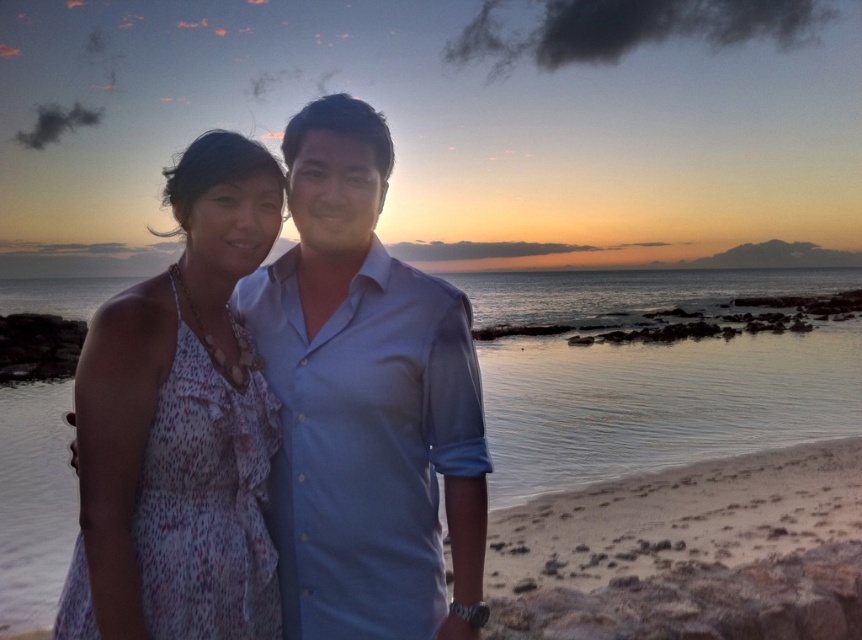
Who is positioned more to the right, light blue shirt at center or clear water at center?

clear water at center is more to the right.

Does light blue shirt at center appear under clear water at center?

Yes, light blue shirt at center is below clear water at center.

Identify the location of light blue shirt at center. pyautogui.click(x=365, y=403).

Is light blue shirt at center shorter than white dotted dress at left?

No.

Does light blue shirt at center lie in front of white dotted dress at left?

No, light blue shirt at center is further to the viewer.

Find the location of a particular element. This screenshot has width=862, height=640. light blue shirt at center is located at coordinates (365, 403).

Can you confirm if clear water at center is smaller than white dotted dress at left?

Actually, clear water at center might be larger than white dotted dress at left.

Does clear water at center appear under white dotted dress at left?

No.

Is point (536, 417) farther from camera compared to point (200, 472)?

Yes, point (536, 417) is behind point (200, 472).

The image size is (862, 640). What are the coordinates of `clear water at center` in the screenshot? It's located at (659, 403).